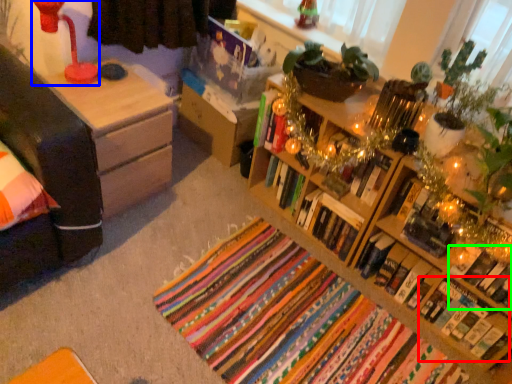
Question: Which object is positioned closest to book (highlighted by a red box)? Select from lamp (highlighted by a blue box) and book (highlighted by a green box).

Choices:
 (A) lamp
 (B) book

Answer: (B)